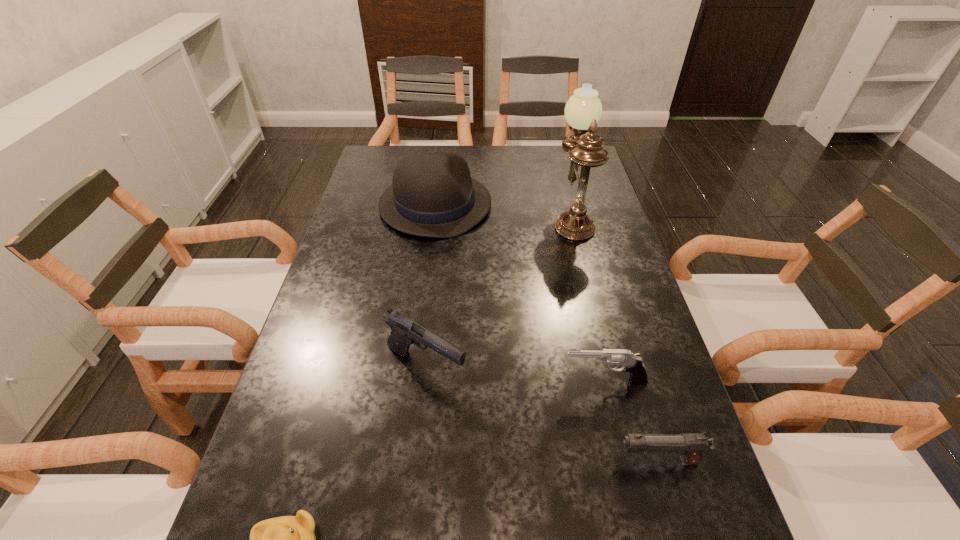
The height and width of the screenshot is (540, 960). Find the location of `unoccupied position between the oil lamp and the bowler hat`. unoccupied position between the oil lamp and the bowler hat is located at coordinates (504, 210).

This screenshot has width=960, height=540. I want to click on empty location between the third tallest object and the tallest object, so click(x=498, y=292).

At what (x,y) coordinates should I click in order to perform the action: click on vacant space that's between the leftmost gun and the bowler hat. Please return your answer as a coordinate pair (x, y). This screenshot has height=540, width=960. Looking at the image, I should click on (430, 286).

In order to click on unoccupied position between the leftmost gun and the second nearest object in this screenshot , I will do `click(541, 414)`.

This screenshot has width=960, height=540. Find the location of `free space between the oil lamp and the second nearest object`. free space between the oil lamp and the second nearest object is located at coordinates (615, 339).

Where is `object that is the second closest to the duckling`? This screenshot has width=960, height=540. object that is the second closest to the duckling is located at coordinates (632, 363).

Identify which object is the fifth closest to the shortest object. Please provide its 2D coordinates. Your answer should be formatted as a tuple, i.e. [(x, y)], where the tuple contains the x and y coordinates of a point satisfying the conditions above.

[(583, 110)]

Locate an element on the screen. Image resolution: width=960 pixels, height=540 pixels. gun that can be found as the closest to the tallest object is located at coordinates (404, 331).

This screenshot has width=960, height=540. I want to click on gun that is the third nearest to the bowler hat, so click(x=691, y=445).

The image size is (960, 540). Find the location of `free space that satisfies the following two spatial constraints: 1. on the front side of the tallest object; 2. at the muzzle of the third tallest object`. free space that satisfies the following two spatial constraints: 1. on the front side of the tallest object; 2. at the muzzle of the third tallest object is located at coordinates point(610,367).